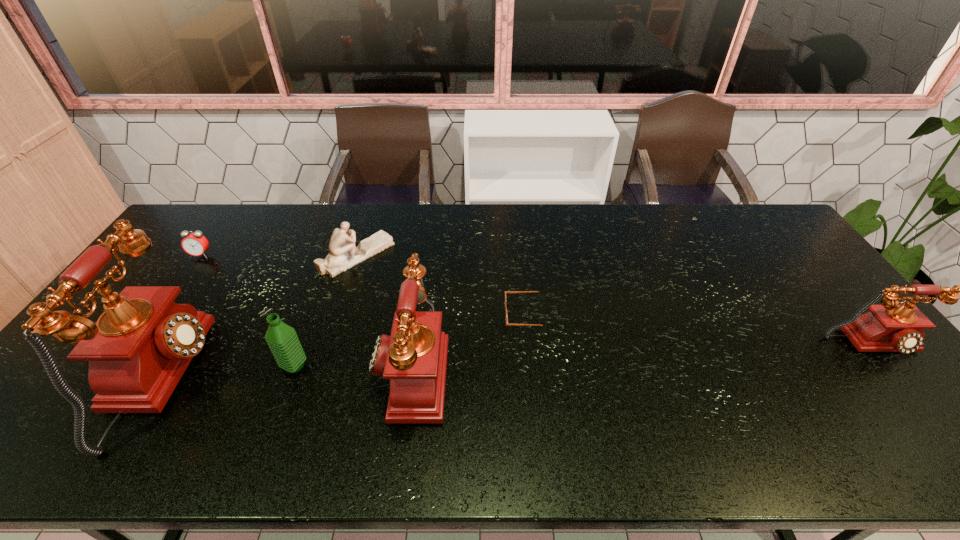
Identify the location of object that is the fourth closest to the figurine. (195, 244).

Locate an element on the screen. This screenshot has width=960, height=540. telephone that is the closest to the figurine is located at coordinates (415, 354).

I want to click on telephone object that ranks as the second closest to the water bottle, so click(x=415, y=354).

This screenshot has width=960, height=540. I want to click on vacant region that satisfies the following two spatial constraints: 1. on the front side of the water bottle; 2. on the dial of the leftmost telephone, so click(x=290, y=380).

Locate an element on the screen. The width and height of the screenshot is (960, 540). vacant area in the image that satisfies the following two spatial constraints: 1. on the dial of the rightmost telephone; 2. on the dial of the third object from right to left is located at coordinates (890, 368).

This screenshot has height=540, width=960. I want to click on free location that satisfies the following two spatial constraints: 1. on the dial of the rightmost object; 2. on the dial of the leftmost telephone, so click(900, 380).